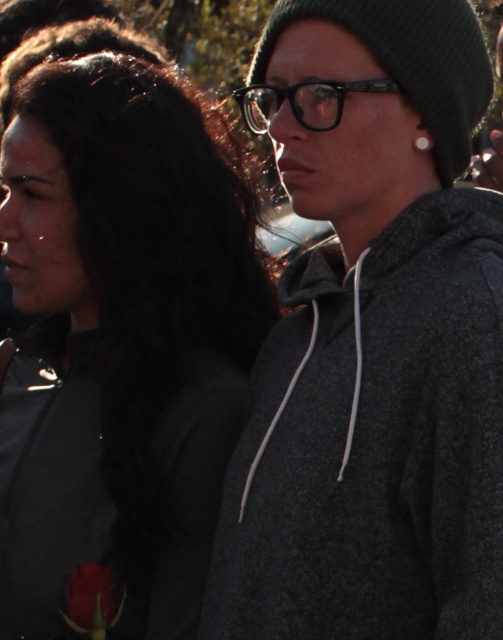
Is matte black hair at left smaller than matte red rose at lower left?

Actually, matte black hair at left might be larger than matte red rose at lower left.

Is matte black hair at left to the left of matte red rose at lower left from the viewer's perspective?

No, matte black hair at left is not to the left of matte red rose at lower left.

You are a GUI agent. You are given a task and a screenshot of the screen. Output one action in this format:
    pyautogui.click(x=<x>, y=<y>)
    Task: Click on the matte black hair at left
    The height and width of the screenshot is (640, 503).
    Given the screenshot: What is the action you would take?
    point(122,340)

This screenshot has width=503, height=640. What do you see at coordinates (122, 340) in the screenshot?
I see `matte black hair at left` at bounding box center [122, 340].

Which is below, matte black hair at left or silver metallic earring at upper center?

Positioned lower is matte black hair at left.

Is point (154, 284) more distant than point (413, 147)?

Yes, it is behind point (413, 147).

Locate an element on the screen. Image resolution: width=503 pixels, height=640 pixels. matte black hair at left is located at coordinates (122, 340).

Which is more to the right, matte red rose at lower left or silver metallic earring at upper center?

silver metallic earring at upper center

Who is shorter, matte red rose at lower left or silver metallic earring at upper center?

A: silver metallic earring at upper center is shorter.

Which is in front, point (82, 632) or point (418, 150)?

Positioned in front is point (418, 150).

At what (x,y) coordinates should I click in order to perform the action: click on matte red rose at lower left. Please return your answer as a coordinate pair (x, y). Image resolution: width=503 pixels, height=640 pixels. Looking at the image, I should click on (91, 600).